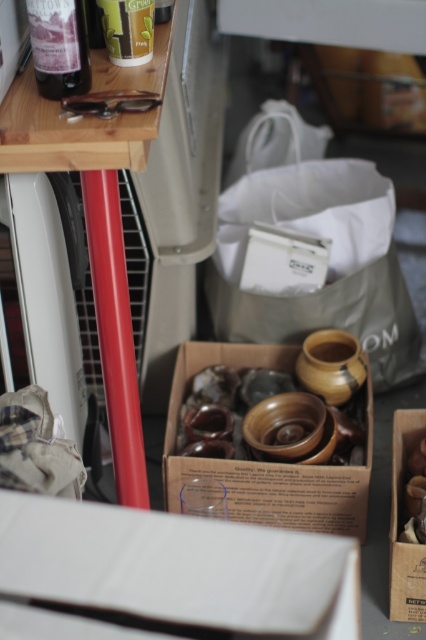
Is white cardboard box at lower center taller than translucent plastic cup at upper left?

Incorrect, white cardboard box at lower center's height is not larger of translucent plastic cup at upper left's.

Which is behind, point (60, 518) or point (131, 4)?

Point (131, 4)

The height and width of the screenshot is (640, 426). What do you see at coordinates (166, 573) in the screenshot?
I see `white cardboard box at lower center` at bounding box center [166, 573].

This screenshot has height=640, width=426. Identify the location of white cardboard box at lower center. (166, 573).

Is wooden bowls at center taller than wooden spoon at center?

Correct, wooden bowls at center is much taller as wooden spoon at center.

Can you confirm if wooden bowls at center is thinner than wooden spoon at center?

No, wooden bowls at center is not thinner than wooden spoon at center.

You are a GUI agent. You are given a task and a screenshot of the screen. Output one action in this format:
    pyautogui.click(x=<x>, y=<y>)
    Task: Click on the wooden bowls at center
    The image size is (426, 640).
    Given the screenshot: What is the action you would take?
    pyautogui.click(x=267, y=461)

Is white cardboard box at lower center in front of wooden box at lower right?

Yes, it is in front of wooden box at lower right.

The height and width of the screenshot is (640, 426). What do you see at coordinates (166, 573) in the screenshot? I see `white cardboard box at lower center` at bounding box center [166, 573].

Identify the location of white cardboard box at lower center. The height and width of the screenshot is (640, 426). tap(166, 573).